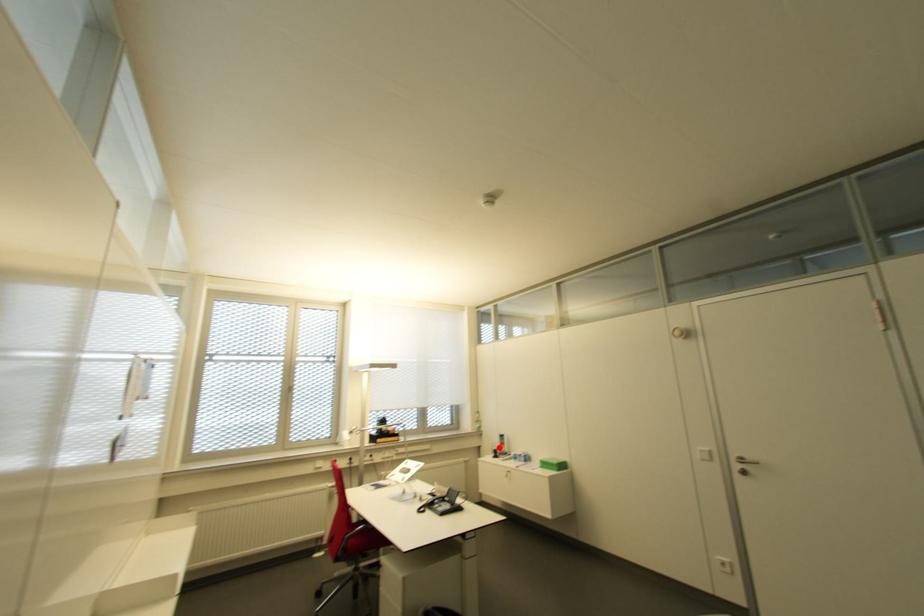
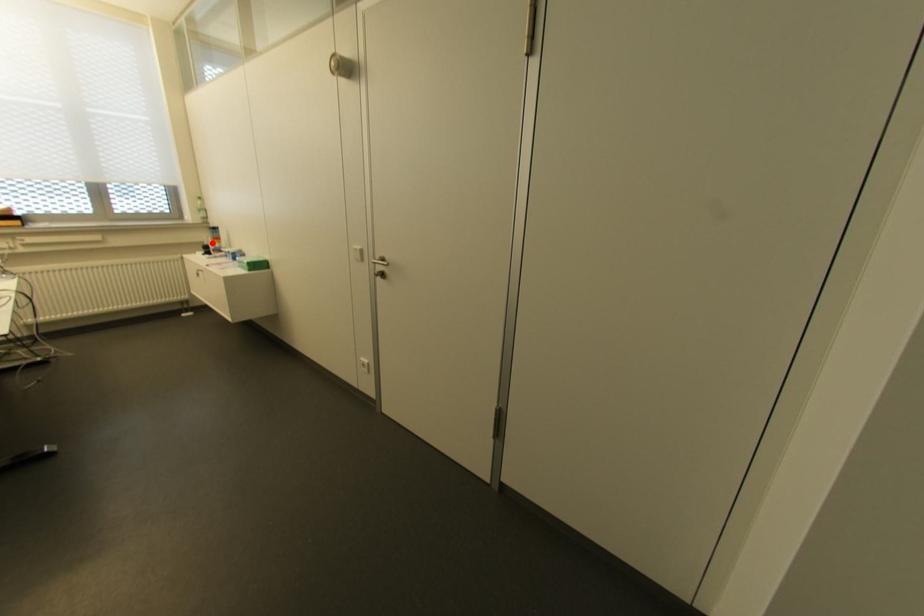
I am providing you with two images of the same scene from different viewpoints. A red point is marked on the first image and another point is marked on the second image. Are the points marked in image1 and image2 representing the same 3D position?

Yes